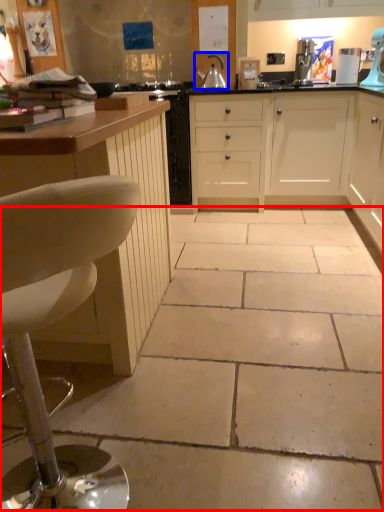
Question: Among these objects, which one is nearest to the camera, concrete (highlighted by a red box) or kitchen appliance (highlighted by a blue box)?

Choices:
 (A) concrete
 (B) kitchen appliance

Answer: (A)